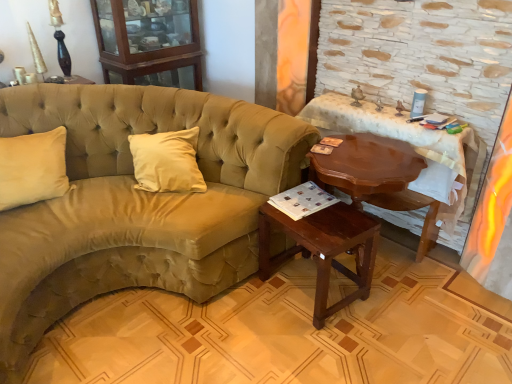
This screenshot has height=384, width=512. What do you see at coordinates (135, 202) in the screenshot?
I see `suede-like beige couch at left` at bounding box center [135, 202].

The width and height of the screenshot is (512, 384). I want to click on mahogany wood side table at lower center, the first table in the left-to-right sequence, so click(x=323, y=249).

Describe the element at coordinates (414, 149) in the screenshot. I see `mahogany wood table at right, the 2th table from the left` at that location.

Image resolution: width=512 pixels, height=384 pixels. In order to click on wooden cabinet at upper left in this screenshot , I will do `click(149, 42)`.

Does point (328, 256) come in front of point (364, 120)?

Yes, it is in front of point (364, 120).

Is mahogany wood side table at lower center, the first table in the left-to-right sequence, positioned in front of mahogany wood table at right, the 2th table from the left?

Yes, mahogany wood side table at lower center, the first table in the left-to-right sequence, is closer to the camera.

From the image's perspective, would you say mahogany wood side table at lower center, the first table in the left-to-right sequence, is shown under mahogany wood table at right, which is the 1th table from right to left?

Correct, mahogany wood side table at lower center, the first table in the left-to-right sequence, appears lower than mahogany wood table at right, which is the 1th table from right to left, in the image.

From a real-world perspective, is mahogany wood side table at lower center, the first table in the left-to-right sequence, positioned above or below wooden cabinet at upper left?

mahogany wood side table at lower center, the first table in the left-to-right sequence, is situated lower than wooden cabinet at upper left in the real world.

Is mahogany wood side table at lower center, which is counted as the 2th table, starting from the right, facing away from wooden cabinet at upper left?

No, wooden cabinet at upper left is not at the back of mahogany wood side table at lower center, which is counted as the 2th table, starting from the right.

Find the location of a particular element. This screenshot has height=384, width=512. table that is the 2nd one below the wooden cabinet at upper left (from a real-world perspective) is located at coordinates (323, 249).

Which of these two, mahogany wood side table at lower center, which is counted as the 2th table, starting from the right, or wooden cabinet at upper left, stands taller?

With more height is wooden cabinet at upper left.

Are suede-like beige couch at left and mahogany wood table at right, which is the 1th table from right to left, making contact?

No, suede-like beige couch at left is not with mahogany wood table at right, which is the 1th table from right to left.

Can you confirm if suede-like beige couch at left is taller than mahogany wood table at right, which is the 1th table from right to left?

Correct, suede-like beige couch at left is much taller as mahogany wood table at right, which is the 1th table from right to left.

In the scene shown: Which object is positioned more to the right, suede-like beige couch at left or mahogany wood table at right, which is the 1th table from right to left?

Positioned to the right is mahogany wood table at right, which is the 1th table from right to left.

Is mahogany wood side table at lower center, which is counted as the 2th table, starting from the right, at the right side of suede-like beige couch at left?

Yes.

There is a mahogany wood side table at lower center, the first table in the left-to-right sequence. Identify the location of studio couch above it (from a real-world perspective). Image resolution: width=512 pixels, height=384 pixels. (135, 202).

Which of these two, mahogany wood side table at lower center, which is counted as the 2th table, starting from the right, or suede-like beige couch at left, stands taller?

suede-like beige couch at left.

Could you tell me if mahogany wood side table at lower center, which is counted as the 2th table, starting from the right, is turned towards suede-like beige couch at left?

No.

Considering the relative sizes of wooden cabinet at upper left and mahogany wood table at right, the 2th table from the left, in the image provided, is wooden cabinet at upper left thinner than mahogany wood table at right, the 2th table from the left,?

No, wooden cabinet at upper left is not thinner than mahogany wood table at right, the 2th table from the left.

Which object is positioned more to the right, wooden cabinet at upper left or mahogany wood table at right, which is the 1th table from right to left?

Positioned to the right is mahogany wood table at right, which is the 1th table from right to left.

From the image's perspective, is wooden cabinet at upper left beneath mahogany wood table at right, the 2th table from the left?

Actually, wooden cabinet at upper left appears above mahogany wood table at right, the 2th table from the left, in the image.

Considering the relative sizes of wooden cabinet at upper left and mahogany wood table at right, which is the 1th table from right to left, in the image provided, is wooden cabinet at upper left taller than mahogany wood table at right, which is the 1th table from right to left,?

Incorrect, the height of wooden cabinet at upper left is not larger of that of mahogany wood table at right, which is the 1th table from right to left.

Who is smaller, wooden cabinet at upper left or suede-like beige couch at left?

With smaller size is wooden cabinet at upper left.

Is wooden cabinet at upper left in front of or behind suede-like beige couch at left in the image?

wooden cabinet at upper left is positioned farther from the viewer than suede-like beige couch at left.

In the scene shown: Is wooden cabinet at upper left not inside suede-like beige couch at left?

Yes.

Can you confirm if mahogany wood table at right, the 2th table from the left, is bigger than suede-like beige couch at left?

No.

Find the location of a particular element. Image resolution: width=512 pixels, height=384 pixels. studio couch on the left of mahogany wood table at right, the 2th table from the left is located at coordinates (135, 202).

What's the angular difference between mahogany wood table at right, the 2th table from the left, and suede-like beige couch at left's facing directions?

There is a 88.7-degree angle between the facing directions of mahogany wood table at right, the 2th table from the left, and suede-like beige couch at left.

Looking at their sizes, would you say mahogany wood table at right, the 2th table from the left, is wider or thinner than suede-like beige couch at left?

Clearly, mahogany wood table at right, the 2th table from the left, has less width compared to suede-like beige couch at left.

Locate an element on the screen. This screenshot has height=384, width=512. table above the mahogany wood side table at lower center, which is counted as the 2th table, starting from the right (from a real-world perspective) is located at coordinates (414, 149).

In the image, there is a mahogany wood side table at lower center, which is counted as the 2th table, starting from the right. Identify the location of armoire above it (from the image's perspective). Image resolution: width=512 pixels, height=384 pixels. (149, 42).

Looking at the image, which one is located further to suede-like beige couch at left, mahogany wood side table at lower center, the first table in the left-to-right sequence, or wooden cabinet at upper left?

wooden cabinet at upper left is further to suede-like beige couch at left.

Based on their spatial positions, is wooden cabinet at upper left or mahogany wood table at right, which is the 1th table from right to left, further from suede-like beige couch at left?

The object further to suede-like beige couch at left is mahogany wood table at right, which is the 1th table from right to left.

When comparing their distances from mahogany wood side table at lower center, the first table in the left-to-right sequence, does mahogany wood table at right, the 2th table from the left, or suede-like beige couch at left seem further?

mahogany wood table at right, the 2th table from the left, is positioned further to the anchor mahogany wood side table at lower center, the first table in the left-to-right sequence.

When comparing their distances from suede-like beige couch at left, does wooden cabinet at upper left or mahogany wood side table at lower center, the first table in the left-to-right sequence, seem closer?

Based on the image, mahogany wood side table at lower center, the first table in the left-to-right sequence, appears to be nearer to suede-like beige couch at left.

Estimate the real-world distances between objects in this image. Which object is further from mahogany wood table at right, which is the 1th table from right to left, wooden cabinet at upper left or mahogany wood side table at lower center, which is counted as the 2th table, starting from the right?

wooden cabinet at upper left.

When comparing their distances from wooden cabinet at upper left, does mahogany wood side table at lower center, the first table in the left-to-right sequence, or suede-like beige couch at left seem further?

Among the two, mahogany wood side table at lower center, the first table in the left-to-right sequence, is located further to wooden cabinet at upper left.

From the picture: Estimate the real-world distances between objects in this image. Which object is closer to mahogany wood side table at lower center, the first table in the left-to-right sequence, suede-like beige couch at left or mahogany wood table at right, which is the 1th table from right to left?

A: suede-like beige couch at left.

Estimate the real-world distances between objects in this image. Which object is closer to suede-like beige couch at left, mahogany wood side table at lower center, which is counted as the 2th table, starting from the right, or mahogany wood table at right, which is the 1th table from right to left?

The object closer to suede-like beige couch at left is mahogany wood side table at lower center, which is counted as the 2th table, starting from the right.

At what (x,y) coordinates should I click in order to perform the action: click on table located between suede-like beige couch at left and mahogany wood table at right, which is the 1th table from right to left, in the left-right direction. Please return your answer as a coordinate pair (x, y). Looking at the image, I should click on (323, 249).

Where is `studio couch between wooden cabinet at upper left and mahogany wood table at right, the 2th table from the left, from left to right`? Image resolution: width=512 pixels, height=384 pixels. studio couch between wooden cabinet at upper left and mahogany wood table at right, the 2th table from the left, from left to right is located at coordinates (135, 202).

At what (x,y) coordinates should I click in order to perform the action: click on studio couch between wooden cabinet at upper left and mahogany wood side table at lower center, which is counted as the 2th table, starting from the right, in the vertical direction. Please return your answer as a coordinate pair (x, y). This screenshot has width=512, height=384. Looking at the image, I should click on (135, 202).

The height and width of the screenshot is (384, 512). Find the location of `table between wooden cabinet at upper left and mahogany wood table at right, which is the 1th table from right to left`. table between wooden cabinet at upper left and mahogany wood table at right, which is the 1th table from right to left is located at coordinates (323, 249).